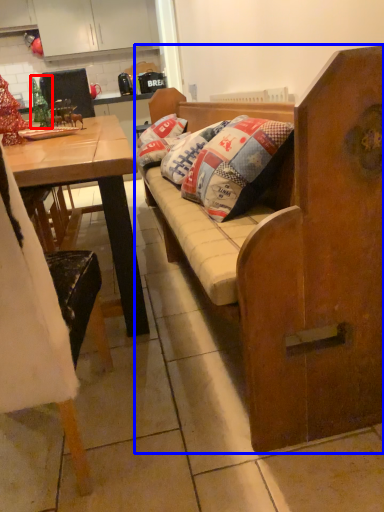
Question: Which point is closer to the camera, christmas decoration (highlighted by a red box) or studio couch (highlighted by a blue box)?

Choices:
 (A) christmas decoration
 (B) studio couch

Answer: (B)